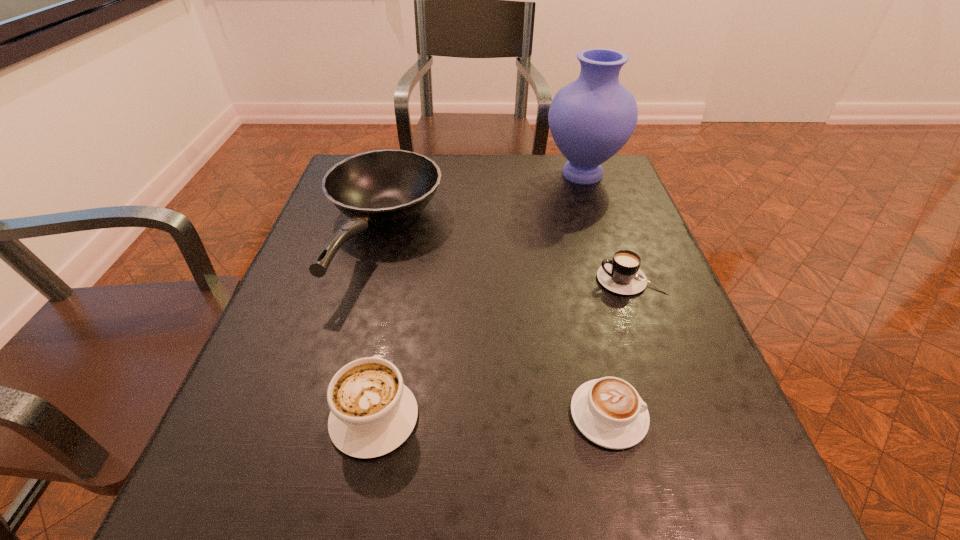
Locate an element on the screen. The width and height of the screenshot is (960, 540). the tallest object is located at coordinates (590, 119).

This screenshot has height=540, width=960. Identify the location of frying pan. (387, 187).

Image resolution: width=960 pixels, height=540 pixels. What are the coordinates of `the third shortest object` in the screenshot? It's located at (372, 412).

This screenshot has width=960, height=540. In order to click on the tallest cappuccino in this screenshot , I will do `click(372, 412)`.

You are a GUI agent. You are given a task and a screenshot of the screen. Output one action in this format:
    pyautogui.click(x=<x>, y=<y>)
    Task: Click on the farthest cappuccino
    
    Given the screenshot: What is the action you would take?
    pyautogui.click(x=622, y=275)

Where is `vacant space located 0.090m on the front of the vase`? The height and width of the screenshot is (540, 960). vacant space located 0.090m on the front of the vase is located at coordinates (596, 216).

The image size is (960, 540). I want to click on blank space located 0.090m on the front of the fourth shortest object, so click(352, 345).

What are the coordinates of `vacant region located to the right of the third tallest object's handle` in the screenshot? It's located at (402, 273).

The height and width of the screenshot is (540, 960). I want to click on vacant space located to the right of the third tallest object's handle, so click(x=402, y=270).

You are a GUI agent. You are given a task and a screenshot of the screen. Output one action in this format:
    pyautogui.click(x=<x>, y=<y>)
    Task: Click on the free location located 0.170m to the right of the third tallest object's handle
    The image size is (960, 540).
    Given the screenshot: What is the action you would take?
    pyautogui.click(x=396, y=304)